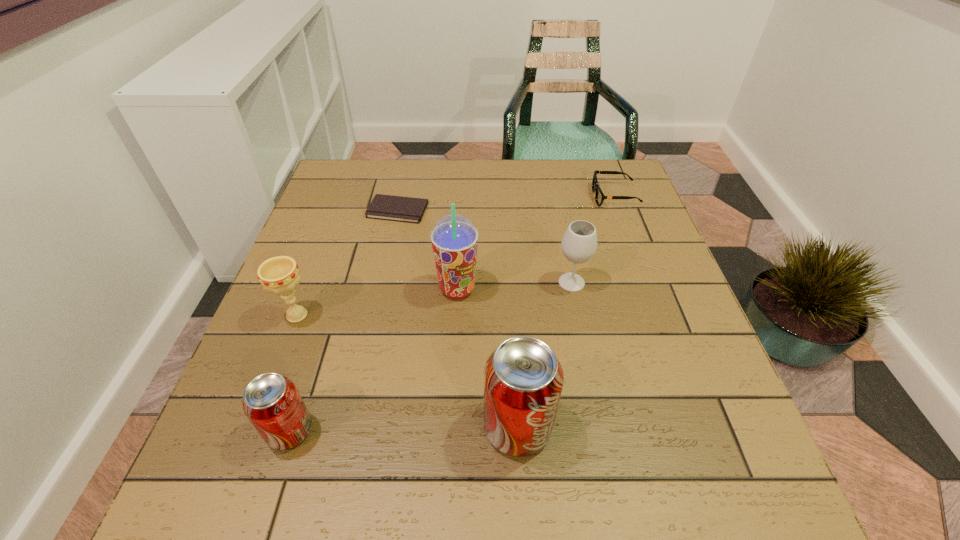
The image size is (960, 540). In order to click on vacant space located 0.130m on the right of the left soda can in this screenshot , I will do `click(388, 430)`.

Identify the location of vacant area situated 0.300m on the left of the right soda can. (311, 427).

The width and height of the screenshot is (960, 540). Identify the location of vacant space situated on the back of the shortest object. (408, 163).

In order to click on vacant space situated on the left of the wineglass in this screenshot , I will do `click(386, 282)`.

In order to click on free space located on the front-facing side of the sixth tallest object in this screenshot , I will do `click(522, 197)`.

Locate an element on the screen. This screenshot has width=960, height=540. free space located on the front-facing side of the sixth tallest object is located at coordinates tap(497, 197).

Find the location of a particular element. free space located 0.100m on the front-facing side of the sixth tallest object is located at coordinates (557, 197).

Where is `free location located on the back of the chalice`? free location located on the back of the chalice is located at coordinates (335, 217).

Locate an element on the screen. vacant space located on the left of the smoothie is located at coordinates (356, 289).

Image resolution: width=960 pixels, height=540 pixels. I want to click on checkbook that is at the far edge, so click(384, 207).